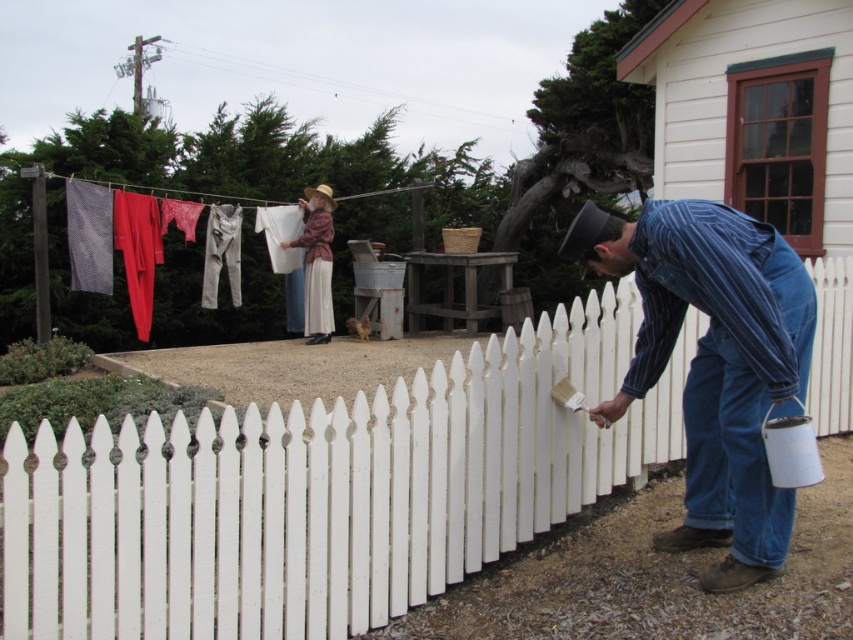
Is blue striped shirt at right to the right of matte white fabric at upper center from the viewer's perspective?

Correct, you'll find blue striped shirt at right to the right of matte white fabric at upper center.

Between blue striped shirt at right and matte white fabric at upper center, which one appears on the left side from the viewer's perspective?

From the viewer's perspective, matte white fabric at upper center appears more on the left side.

Between point (703, 214) and point (328, 278), which one is positioned in front?

Positioned in front is point (703, 214).

I want to click on blue striped shirt at right, so [712, 364].

Does point (363, 620) lie behind point (320, 288)?

No, it is in front of (320, 288).

Does point (445, 387) lie behind point (282, 244)?

No, (445, 387) is closer to viewer.

Locate an element on the screen. This screenshot has width=853, height=640. white wooden picket fence at center is located at coordinates (323, 492).

Is white wooden picket fence at center wider than blue striped shirt at right?

Yes.

Does white wooden picket fence at center appear over blue striped shirt at right?

Actually, white wooden picket fence at center is below blue striped shirt at right.

Locate an element on the screen. white wooden picket fence at center is located at coordinates (323, 492).